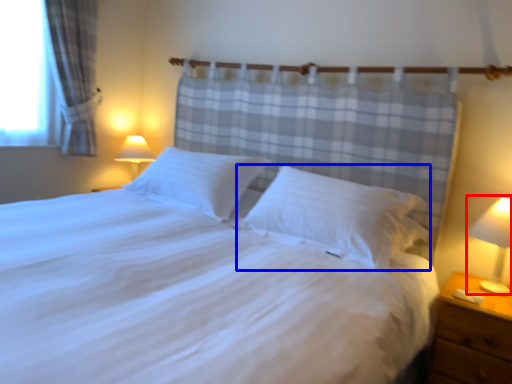
Question: Among these objects, which one is nearest to the camera, bedside lamp (highlighted by a red box) or pillow (highlighted by a blue box)?

Choices:
 (A) bedside lamp
 (B) pillow

Answer: (A)